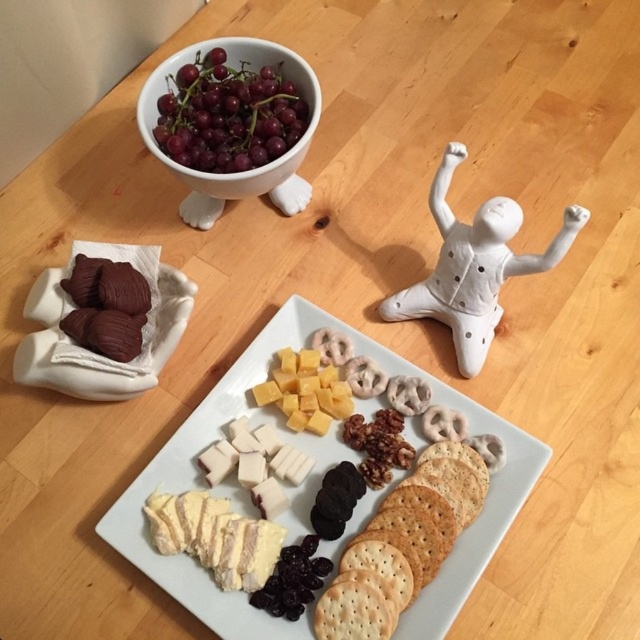
You are setting up a table for a small gathering and need to place a 15 cm tall candle holder in the center. Considering the white matte figurine at upper right and the purple grapes at upper left, which object is suitable to move to make space?

The purple grapes at upper left should be moved because they are much shorter than the white matte figurine at upper right, making them easier to relocate to accommodate the taller candle holder.

You are at a party and want to grab a snack from the purple grapes at upper left and the white matte figurine at upper right. Which one is closer to your right side?

The white matte figurine at upper right is to the right of the purple grapes at upper left, so it is closer to your right side.

You are a guest at a party and want to grab the dark purple grapes at lower center without moving the white matte figurine at upper right. Can you reach them easily?

The white matte figurine at upper right is closer to the viewer than dark purple grapes at lower center, so you can easily reach the dark purple grapes at lower center without disturbing the figurine.